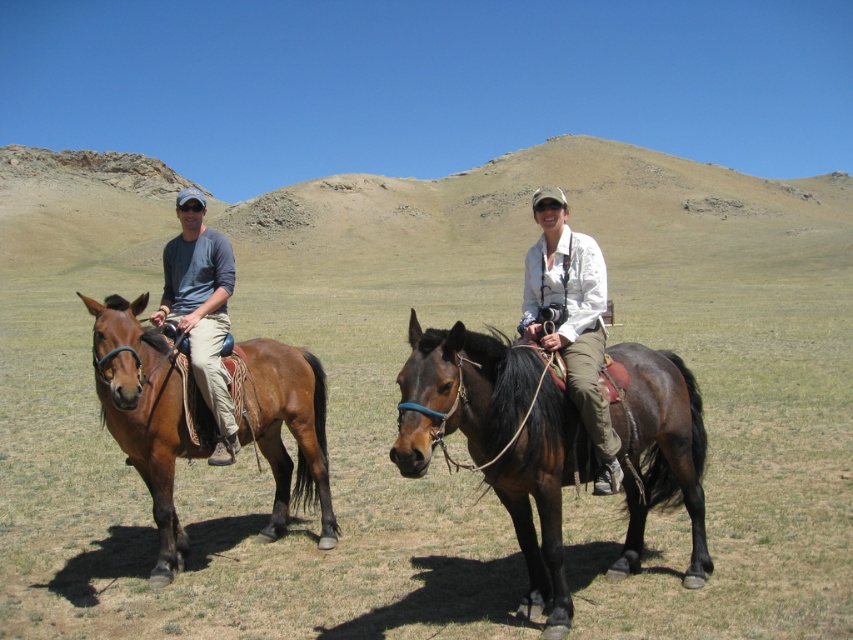
Question: Which of these objects is positioned closest to the matte blue shirt at left?

Choices:
 (A) shiny dark brown horse at center
 (B) brown glossy horse at left

Answer: (B)

Question: Is brown glossy horse at left to the right of white matte jacket at center from the viewer's perspective?

Choices:
 (A) yes
 (B) no

Answer: (B)

Question: Is brown glossy horse at left to the right of matte blue shirt at left from the viewer's perspective?

Choices:
 (A) yes
 (B) no

Answer: (A)

Question: Is shiny dark brown horse at center further to the viewer compared to brown glossy horse at left?

Choices:
 (A) no
 (B) yes

Answer: (A)

Question: Estimate the real-world distances between objects in this image. Which object is closer to the matte blue shirt at left?

Choices:
 (A) brown glossy horse at left
 (B) shiny dark brown horse at center
 (C) white matte jacket at center

Answer: (A)

Question: Which of the following is the closest to the observer?

Choices:
 (A) (194, 364)
 (B) (132, 442)

Answer: (B)